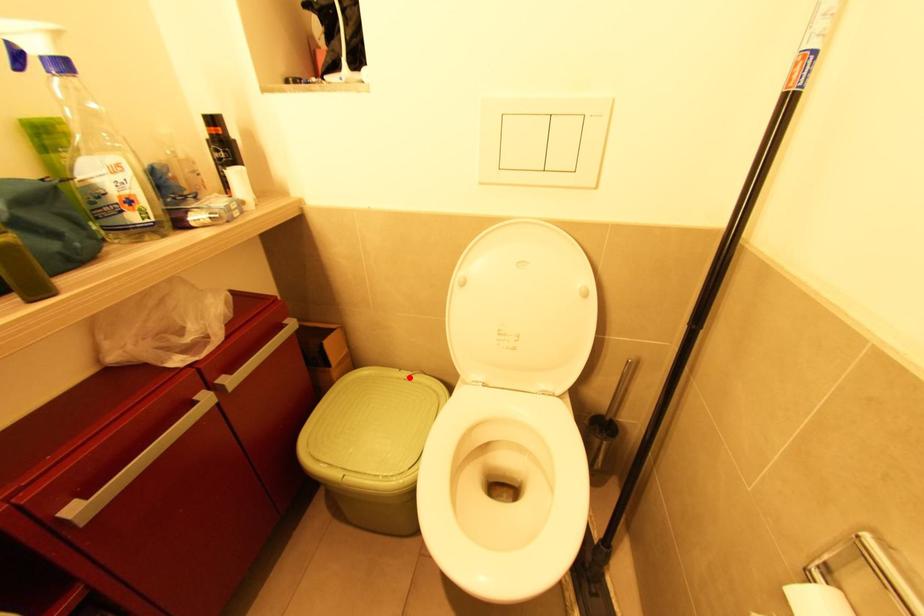
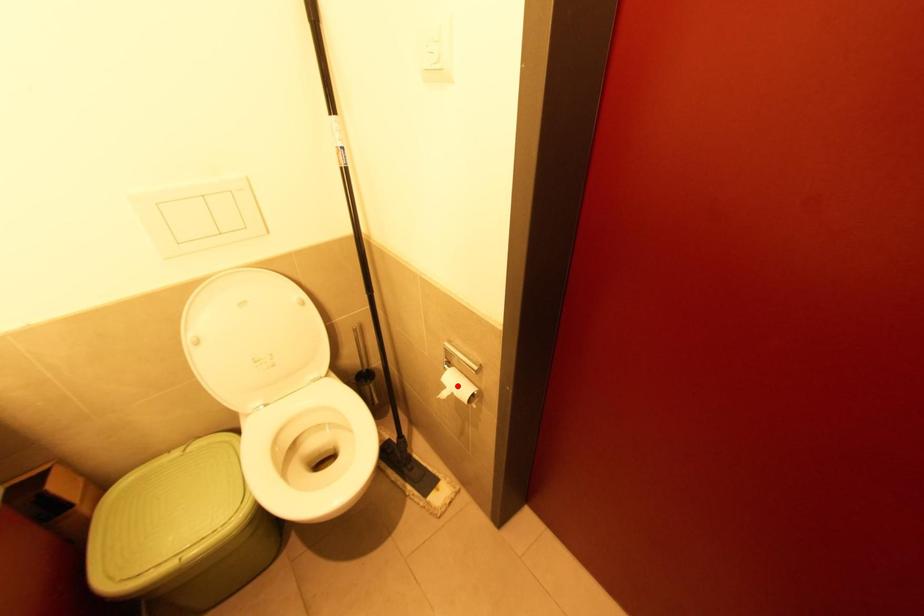
I am providing you with two images of the same scene from different viewpoints. A red point is marked on the first image and another point is marked on the second image. Is the marked point in image1 the same physical position as the marked point in image2?

No